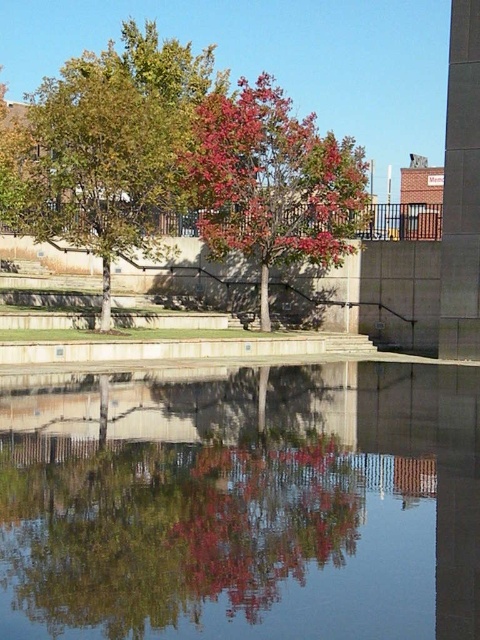
You are a GUI agent. You are given a task and a screenshot of the screen. Output one action in this format:
    pyautogui.click(x=<x>, y=<y>)
    Task: Click on the green leafy tree at center
    The image size is (480, 640).
    Given the screenshot: What is the action you would take?
    pyautogui.click(x=110, y=147)

Is green leafy tree at center wider than shiny red leaves at center?

Yes.

I want to click on green leafy tree at center, so click(110, 147).

In the scene shown: Does smooth reflective water at center have a greater width compared to green leafy tree at center?

Incorrect, smooth reflective water at center's width does not surpass green leafy tree at center's.

Who is more forward, (365,540) or (163,132)?

Point (365,540) is more forward.

Between point (107, 620) and point (159, 113), which one is positioned behind?

Positioned behind is point (159, 113).

Image resolution: width=480 pixels, height=640 pixels. What are the coordinates of `smooth reflective water at center` in the screenshot? It's located at (243, 506).

Can you confirm if smooth reflective water at center is taller than shiny red leaves at center?

No, smooth reflective water at center is not taller than shiny red leaves at center.

Between smooth reflective water at center and shiny red leaves at center, which one has less height?

smooth reflective water at center

Locate an element on the screen. Image resolution: width=480 pixels, height=640 pixels. smooth reflective water at center is located at coordinates (243, 506).